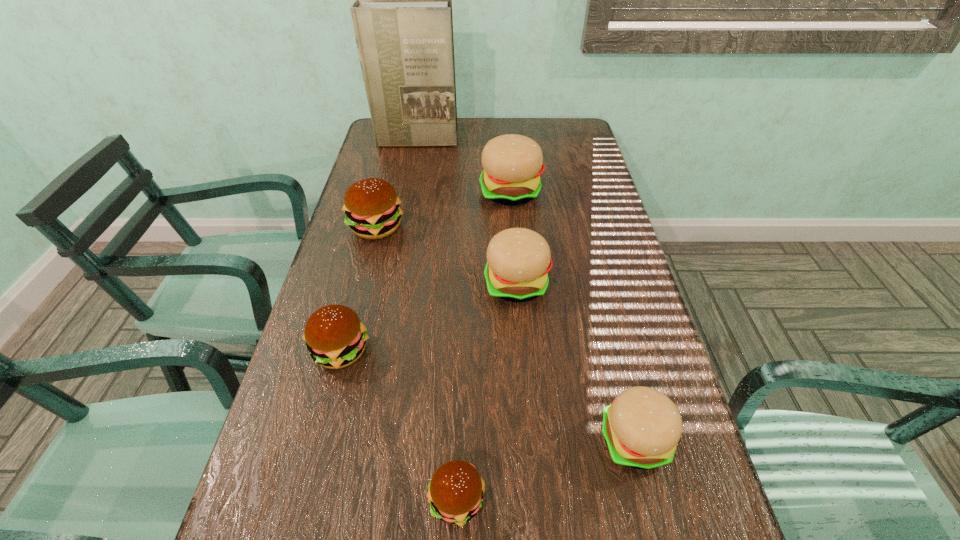
Locate an element on the screen. The height and width of the screenshot is (540, 960). phonebook at the left edge is located at coordinates (402, 16).

You are a GUI agent. You are given a task and a screenshot of the screen. Output one action in this format:
    pyautogui.click(x=<x>, y=<y>)
    Task: Click on the object situated at the right edge
    The height and width of the screenshot is (540, 960).
    Given the screenshot: What is the action you would take?
    pyautogui.click(x=641, y=428)

Where is `object that is positioned at the far left corner`? The height and width of the screenshot is (540, 960). object that is positioned at the far left corner is located at coordinates (x=402, y=16).

The image size is (960, 540). Identify the location of vacant space at the left edge of the desktop. (366, 385).

This screenshot has width=960, height=540. I want to click on vacant space at the right edge of the desktop, so tap(582, 282).

In the image, there is a desktop. Identify the location of vacant space at the far right corner. The image size is (960, 540). (550, 130).

You are a GUI agent. You are given a task and a screenshot of the screen. Output one action in this format:
    pyautogui.click(x=<x>, y=<y>)
    Task: Click on the unoccupied area between the nearest beige hamburger and the farthest beige hamburger
    
    Given the screenshot: What is the action you would take?
    pyautogui.click(x=573, y=316)

Locate an element on the screen. This screenshot has height=540, width=960. free space between the second nearest beige hamburger and the third nearest object is located at coordinates (429, 317).

The image size is (960, 540). I want to click on vacant area between the smallest brown hamburger and the second smallest brown hamburger, so click(398, 425).

I want to click on empty location between the tallest object and the nearest brown hamburger, so click(x=437, y=320).